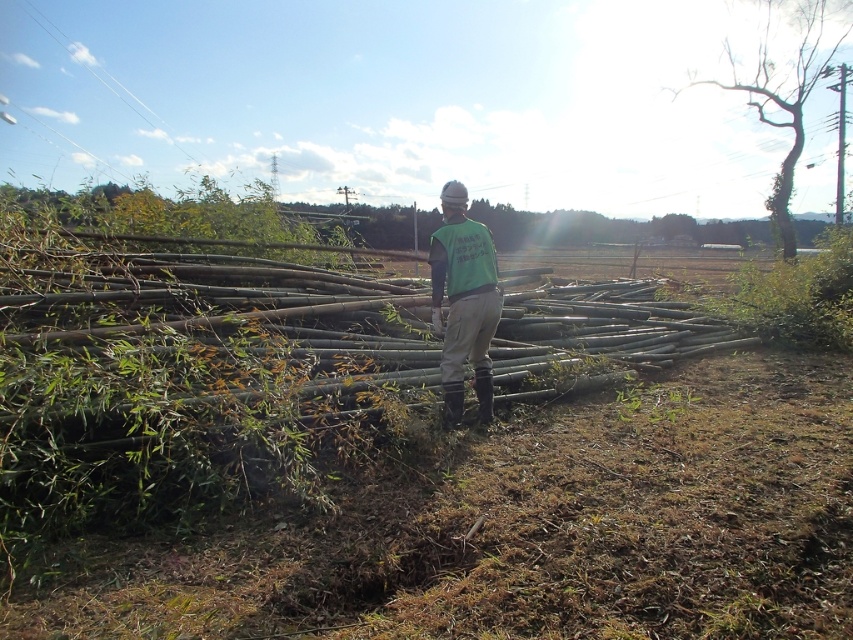
You are a photographer positioned in the field. You want to take a photo that includes both the bare wood tree at upper right and the green fabric vest at center. Which object should you adjust your camera focus to first to ensure both are in the frame?

The bare wood tree at upper right is further to the viewer than the green fabric vest at center, so you should focus on the bare wood tree at upper right first to ensure both are in the frame.

You are a painter standing in the middle of the bamboo pile and want to paint the bare wood tree at upper right and the green fabric vest at center. Which object should you focus on first if you want to paint the wider object first?

The bare wood tree at upper right might be wider than green fabric vest at center, so you should focus on painting the bare wood tree at upper right first.